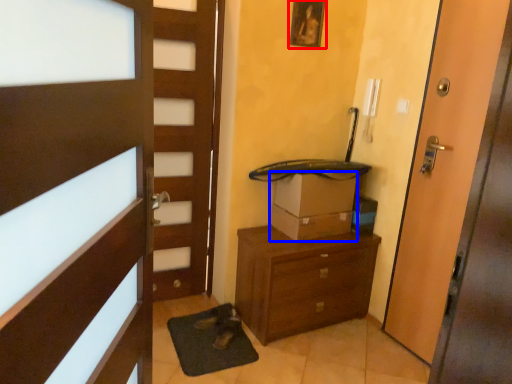
Question: Which object appears closest to the camera in this image, picture frame (highlighted by a red box) or cardboard box (highlighted by a blue box)?

Choices:
 (A) picture frame
 (B) cardboard box

Answer: (A)